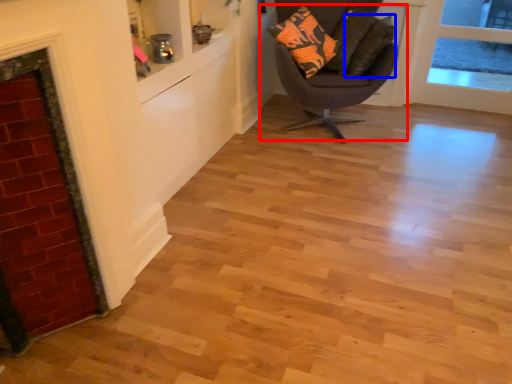
Question: Which object is further to the camera taking this photo, chair (highlighted by a red box) or pillow (highlighted by a blue box)?

Choices:
 (A) chair
 (B) pillow

Answer: (B)